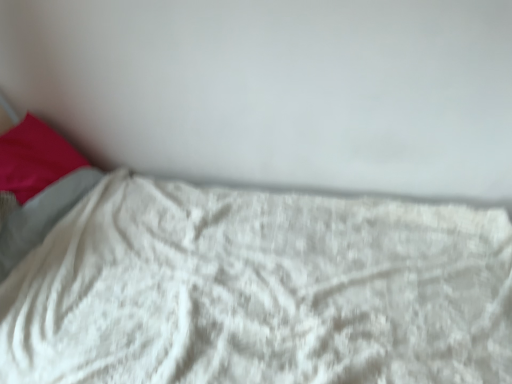
Question: Could you tell me if white fluffy blanket at lower center is turned towards matte pink pillow at left?

Choices:
 (A) no
 (B) yes

Answer: (A)

Question: Would you say white fluffy blanket at lower center is outside matte pink pillow at left?

Choices:
 (A) no
 (B) yes

Answer: (B)

Question: From the image's perspective, is white fluffy blanket at lower center under matte pink pillow at left?

Choices:
 (A) yes
 (B) no

Answer: (A)

Question: From a real-world perspective, is white fluffy blanket at lower center positioned over matte pink pillow at left based on gravity?

Choices:
 (A) yes
 (B) no

Answer: (B)

Question: Are white fluffy blanket at lower center and matte pink pillow at left far apart?

Choices:
 (A) yes
 (B) no

Answer: (B)

Question: Considering the relative positions of white fluffy blanket at lower center and matte pink pillow at left in the image provided, is white fluffy blanket at lower center to the right of matte pink pillow at left from the viewer's perspective?

Choices:
 (A) yes
 (B) no

Answer: (A)

Question: Is matte pink pillow at left positioned far away from white fluffy blanket at lower center?

Choices:
 (A) yes
 (B) no

Answer: (B)

Question: Can you confirm if matte pink pillow at left is wider than white fluffy blanket at lower center?

Choices:
 (A) yes
 (B) no

Answer: (B)

Question: Can you confirm if matte pink pillow at left is thinner than white fluffy blanket at lower center?

Choices:
 (A) yes
 (B) no

Answer: (A)

Question: Does matte pink pillow at left appear on the left side of white fluffy blanket at lower center?

Choices:
 (A) no
 (B) yes

Answer: (B)

Question: Is matte pink pillow at left outside white fluffy blanket at lower center?

Choices:
 (A) yes
 (B) no

Answer: (B)

Question: Does matte pink pillow at left appear on the right side of white fluffy blanket at lower center?

Choices:
 (A) yes
 (B) no

Answer: (B)

Question: From their relative heights in the image, would you say matte pink pillow at left is taller or shorter than white fluffy blanket at lower center?

Choices:
 (A) short
 (B) tall

Answer: (A)